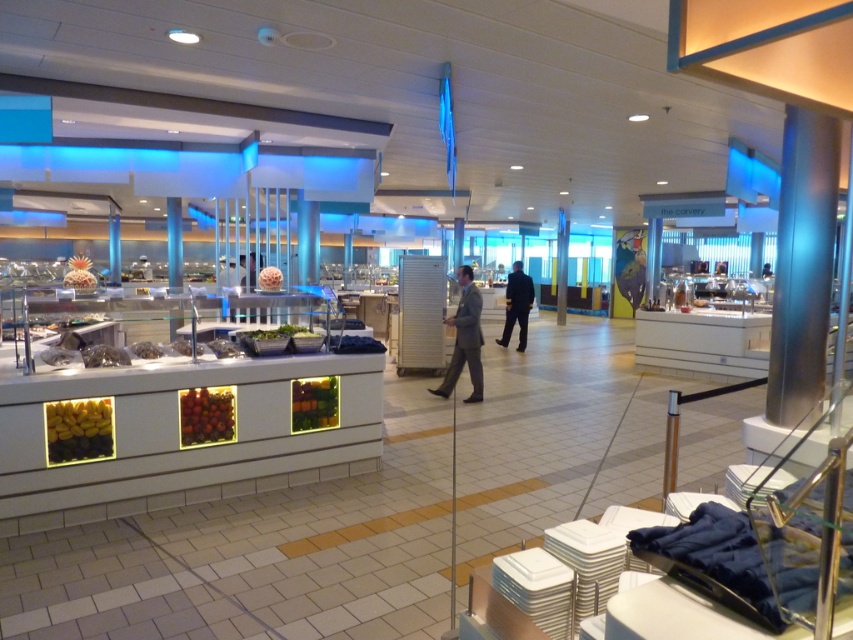
Question: Among these points, which one is nearest to the camera?

Choices:
 (A) (514, 273)
 (B) (480, 369)
 (C) (259, 284)

Answer: (C)

Question: Among these points, which one is nearest to the camera?

Choices:
 (A) (187, 397)
 (B) (59, 436)

Answer: (B)

Question: Among these points, which one is nearest to the camera?

Choices:
 (A) (514, 296)
 (B) (315, 422)
 (C) (265, 273)

Answer: (B)

Question: Does yellow bananas at lower left lie in front of translucent plastic container at center?

Choices:
 (A) yes
 (B) no

Answer: (A)

Question: Is gray suit at center to the right of shiny red apples at center from the viewer's perspective?

Choices:
 (A) yes
 (B) no

Answer: (A)

Question: From the image, what is the correct spatial relationship of yellow bananas at lower left in relation to translucent plastic container at center?

Choices:
 (A) left
 (B) right

Answer: (A)